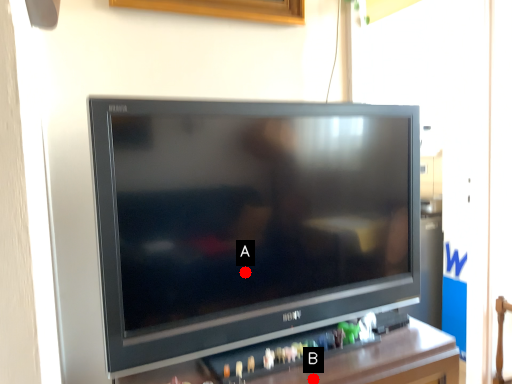
Question: Two points are circled on the image, labeled by A and B beside each circle. Which point is closer to the camera?

Choices:
 (A) A is closer
 (B) B is closer

Answer: (B)